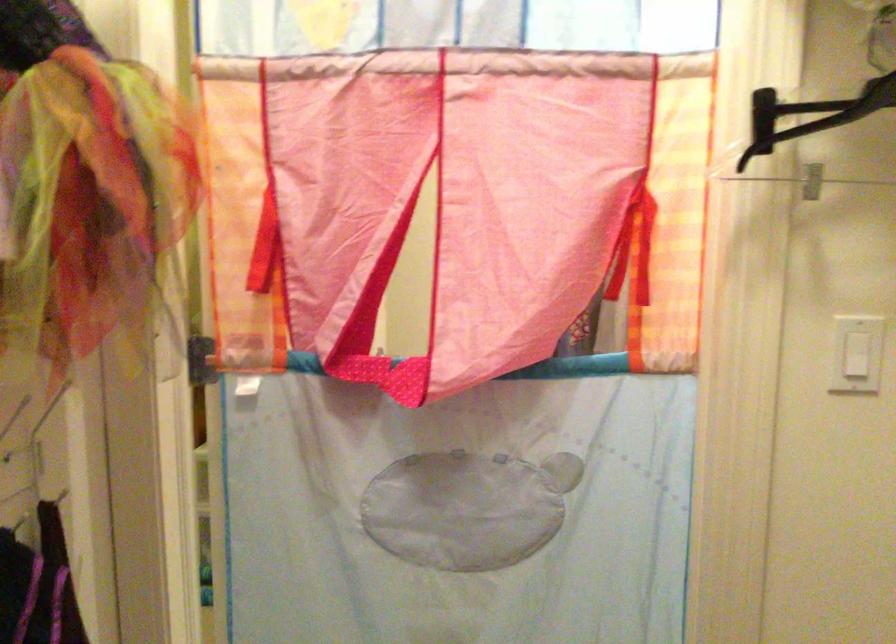
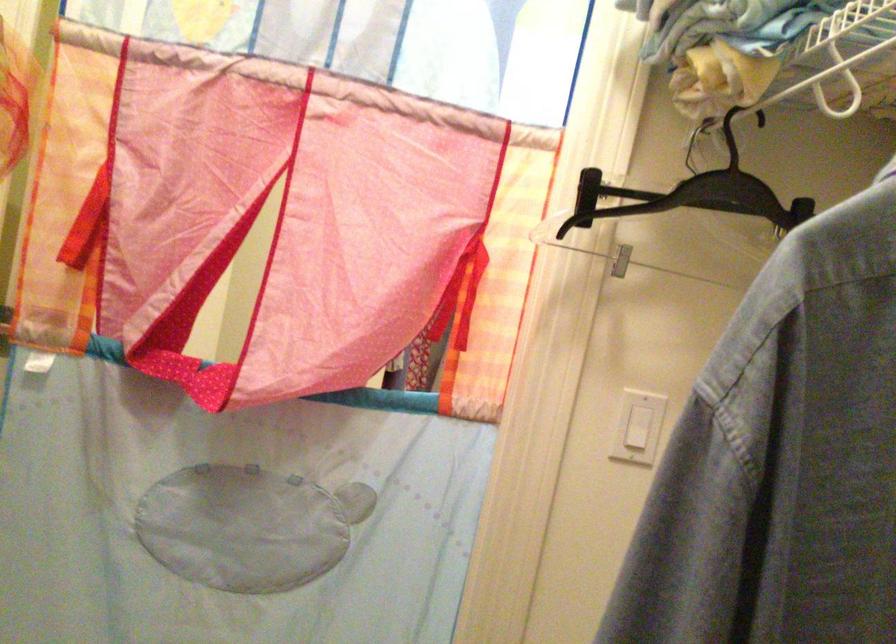
In the second image, find the point that corresponds to the point at 812,182 in the first image.

(622, 261)